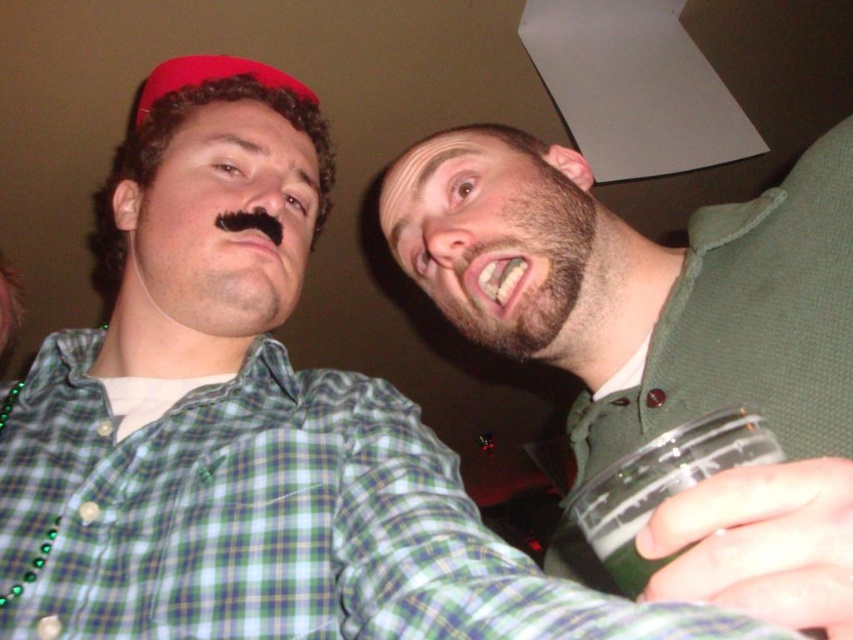
Question: Which point is closer to the camera?

Choices:
 (A) green matte cup at right
 (B) dark brown stubble at upper right
 (C) green frothy liquid at lower right

Answer: (A)

Question: Does green matte cup at right appear on the right side of green frothy liquid at lower right?

Choices:
 (A) yes
 (B) no

Answer: (A)

Question: Does green matte cup at right appear over dark brown stubble at upper right?

Choices:
 (A) no
 (B) yes

Answer: (A)

Question: Based on their relative distances, which object is farther from the dark brown stubble at upper right?

Choices:
 (A) green matte cup at right
 (B) green frothy liquid at lower right

Answer: (B)

Question: Can you confirm if green matte cup at right is positioned above green frothy liquid at lower right?

Choices:
 (A) no
 (B) yes

Answer: (B)

Question: Which of the following is the farthest from the observer?

Choices:
 (A) (648, 445)
 (B) (648, 406)
 (C) (583, 234)

Answer: (C)